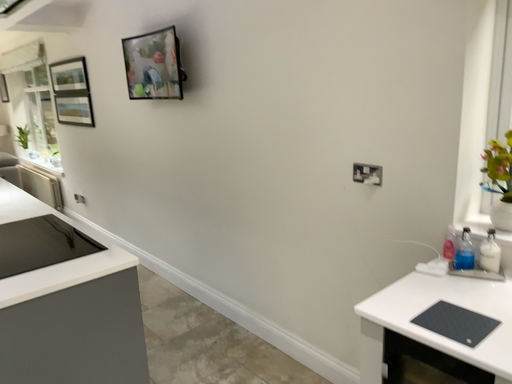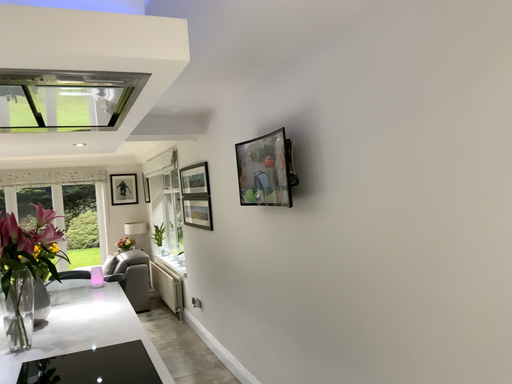
Question: Which way did the camera rotate in the video?

Choices:
 (A) rotated upward
 (B) rotated downward

Answer: (A)